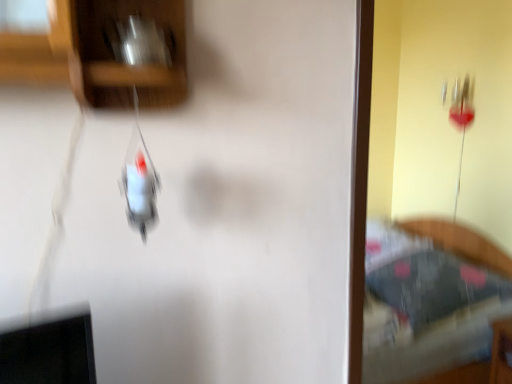
At what (x,y) coordinates should I click in order to perform the action: click on wooden bed frame at right. Please return your answer as a coordinate pair (x, y). The height and width of the screenshot is (384, 512). Looking at the image, I should click on (424, 307).

What do you see at coordinates (424, 307) in the screenshot? I see `wooden bed frame at right` at bounding box center [424, 307].

Measure the distance between point (376, 379) and camera.

The distance of point (376, 379) from camera is 6.56 feet.

This screenshot has width=512, height=384. I want to click on wooden bed frame at right, so click(x=424, y=307).